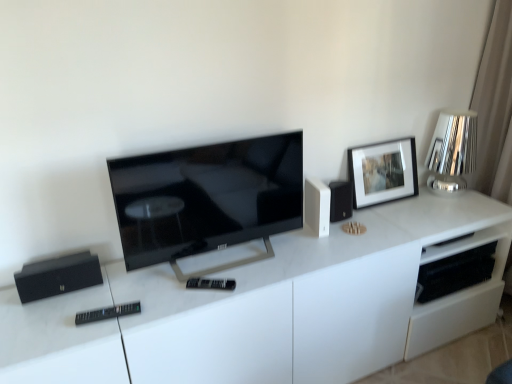
Image resolution: width=512 pixels, height=384 pixels. Find the location of `free space between black plastic remote at lower left, marked as the 2th remote in a back-to-front arrangement, and white matte speaker at upper right`. free space between black plastic remote at lower left, marked as the 2th remote in a back-to-front arrangement, and white matte speaker at upper right is located at coordinates (232, 272).